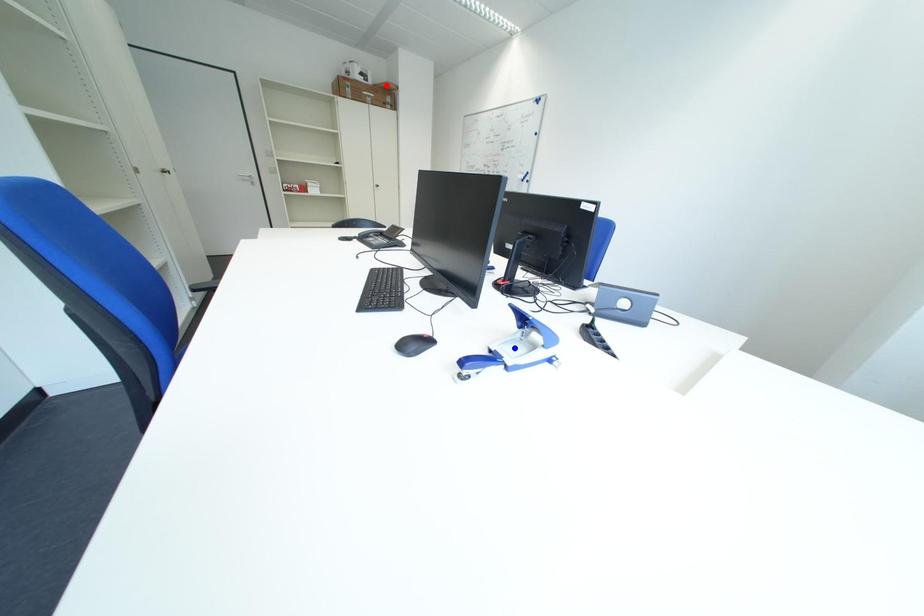
Question: In the image, two points are highlighted. Which point is nearer to the camera? Reply with the corresponding letter.

Choices:
 (A) blue point
 (B) red point

Answer: (A)